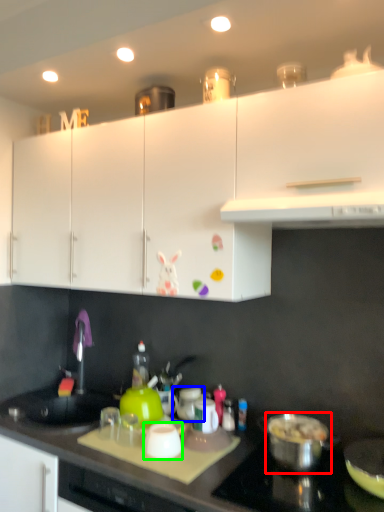
Question: Which object is the farthest from kitchen appliance (highlighted by a red box)? Choose among these: appliance (highlighted by a blue box) or kitchen appliance (highlighted by a green box).

Choices:
 (A) appliance
 (B) kitchen appliance

Answer: (B)